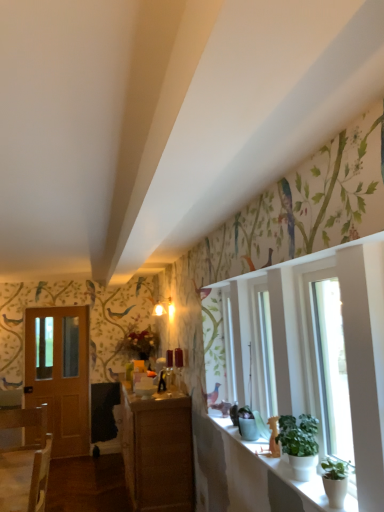
Question: Is transparent glass window at right bigger or smaller than wooden cabinet at center?

Choices:
 (A) small
 (B) big

Answer: (A)

Question: From the image's perspective, relative to wooden cabinet at center, is transparent glass window at right above or below?

Choices:
 (A) above
 (B) below

Answer: (A)

Question: Which object is positioned closest to the transparent glass window at right?

Choices:
 (A) wooden cabinet at center
 (B) green matte plant at lower right, which is the first houseplant from back to front
 (C) wooden chair at lower left
 (D) white ceramic window sill at lower right
 (E) green matte plant at lower right, the 1th houseplant positioned from the front

Answer: (B)

Question: Estimate the real-world distances between objects in this image. Which object is closer to the wooden cabinet at center?

Choices:
 (A) transparent glass window at right
 (B) wooden door at left
 (C) green matte plant at lower right, which is the first houseplant from back to front
 (D) wooden chair at lower left
 (E) white ceramic window sill at lower right

Answer: (E)